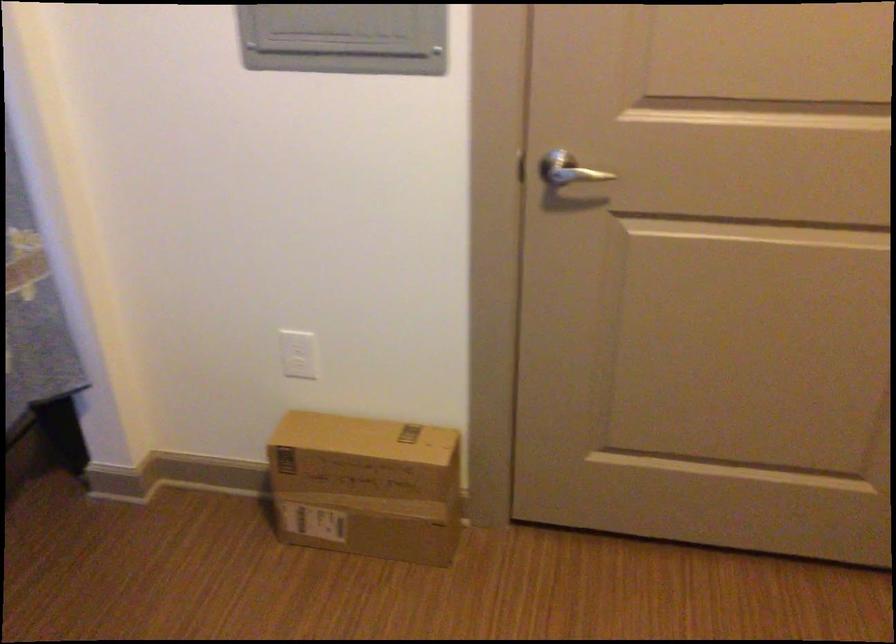
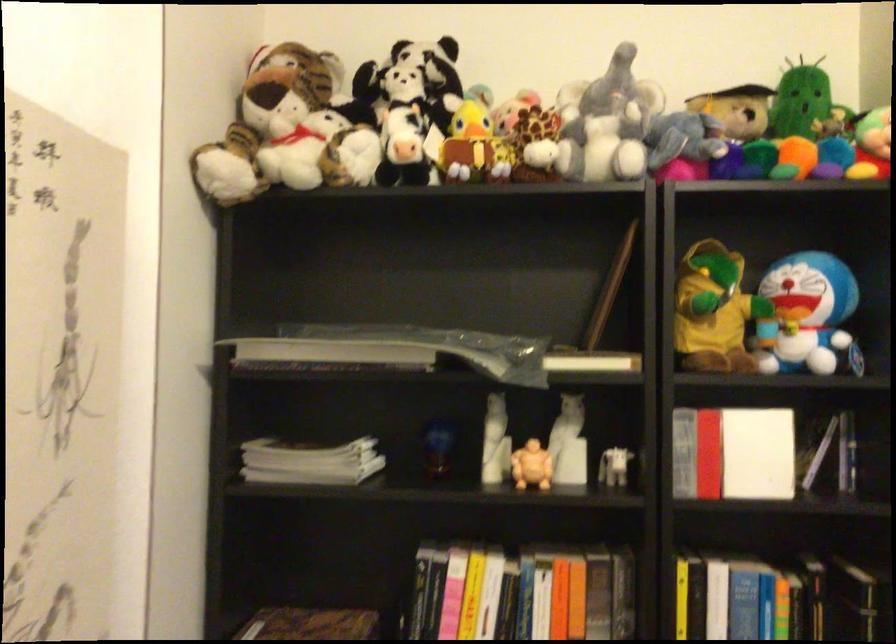
Question: The first image is from the beginning of the video and the second image is from the end. How did the camera likely rotate when shooting the video?

Choices:
 (A) Left
 (B) Right
 (C) Up
 (D) Down

Answer: (B)